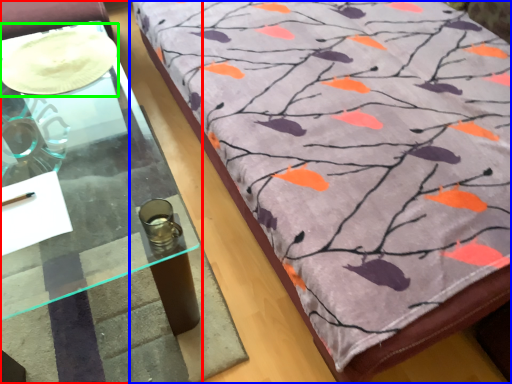
Question: Which is nearer to the table (highlighted by a red box)? furniture (highlighted by a blue box) or glass plate (highlighted by a green box).

Choices:
 (A) furniture
 (B) glass plate

Answer: (B)